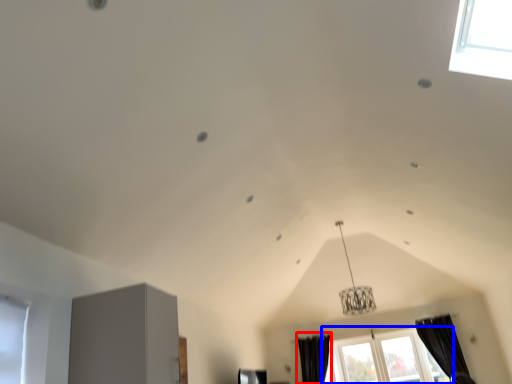
Question: Which object is further to the camera taking this photo, curtain (highlighted by a red box) or window (highlighted by a blue box)?

Choices:
 (A) curtain
 (B) window

Answer: (A)